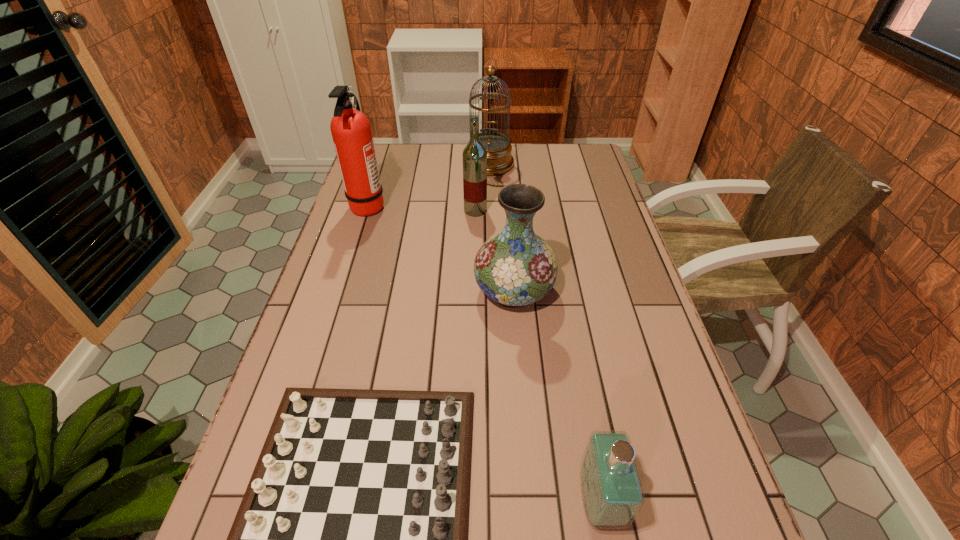
Identify the location of free space between the farthest object and the vase. The width and height of the screenshot is (960, 540). (501, 227).

This screenshot has height=540, width=960. I want to click on the second closest object to the fourth farthest object, so click(474, 155).

The width and height of the screenshot is (960, 540). In order to click on object that is the fifth closest one to the farthest object in this screenshot , I will do `click(612, 493)`.

Where is `vacant space that satisfies the following two spatial constraints: 1. on the back side of the liquor; 2. on the handle side of the fire extinguisher`? This screenshot has width=960, height=540. vacant space that satisfies the following two spatial constraints: 1. on the back side of the liquor; 2. on the handle side of the fire extinguisher is located at coordinates (475, 206).

You are a GUI agent. You are given a task and a screenshot of the screen. Output one action in this format:
    pyautogui.click(x=<x>, y=<y>)
    Task: Click on the free space that satisfies the following two spatial constraints: 1. with an open door on the birdcage; 2. on the handle side of the fire extinguisher
    Image resolution: width=960 pixels, height=540 pixels.
    Given the screenshot: What is the action you would take?
    pyautogui.click(x=491, y=206)

Where is `free location that satisfies the following two spatial constraints: 1. with an open door on the birdcage; 2. on the handle side of the fire extinguisher`? The width and height of the screenshot is (960, 540). free location that satisfies the following two spatial constraints: 1. with an open door on the birdcage; 2. on the handle side of the fire extinguisher is located at coordinates (491, 206).